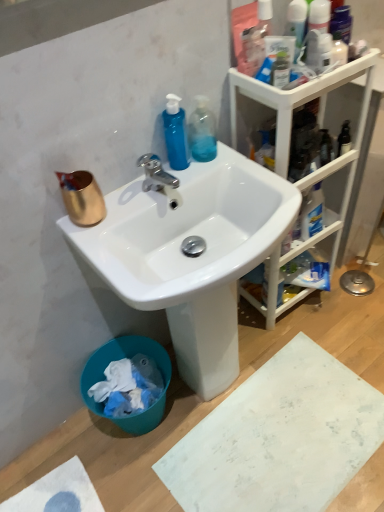
The height and width of the screenshot is (512, 384). I want to click on free point in front of white plastic cabinet at upper right, so click(x=323, y=339).